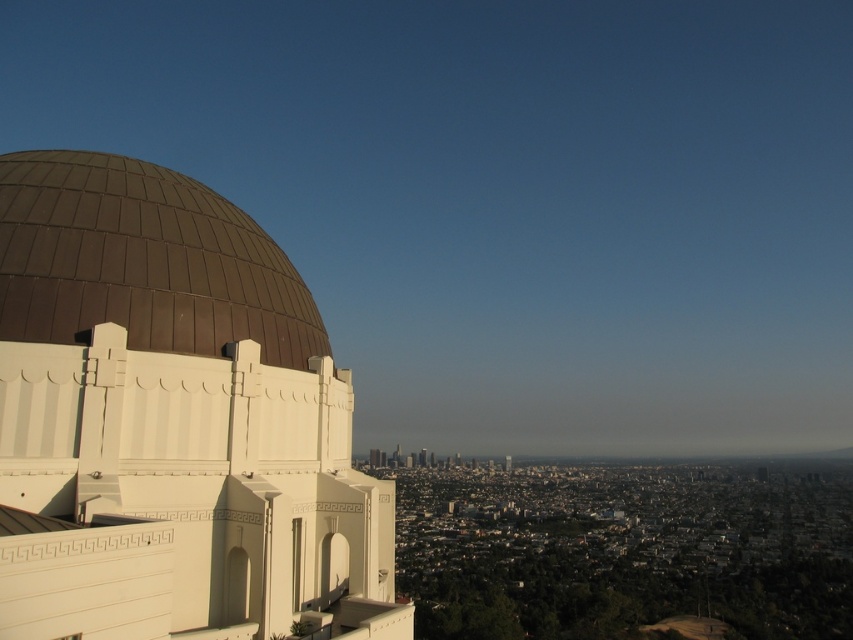
Question: Among these objects, which one is farthest from the camera?

Choices:
 (A) brown matte dome at upper left
 (B) brown metallic dome at left

Answer: (B)

Question: Does brown matte dome at upper left have a larger size compared to brown metallic dome at left?

Choices:
 (A) no
 (B) yes

Answer: (B)

Question: Can you confirm if brown matte dome at upper left is positioned to the right of brown metallic dome at left?

Choices:
 (A) yes
 (B) no

Answer: (A)

Question: Is brown matte dome at upper left further to camera compared to brown metallic dome at left?

Choices:
 (A) yes
 (B) no

Answer: (B)

Question: Which point is closer to the camera taking this photo?

Choices:
 (A) (79, 547)
 (B) (245, 253)

Answer: (A)